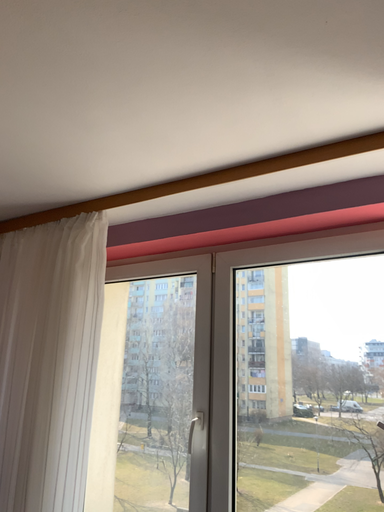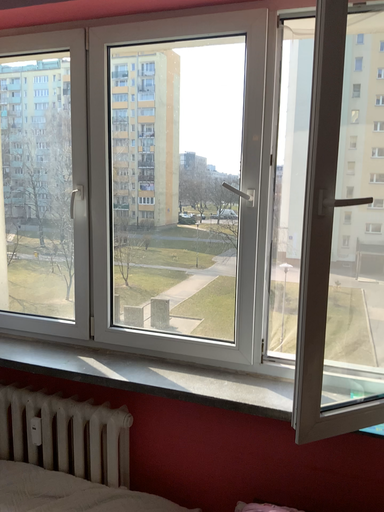
Question: Which way did the camera rotate in the video?

Choices:
 (A) rotated left
 (B) rotated right

Answer: (B)